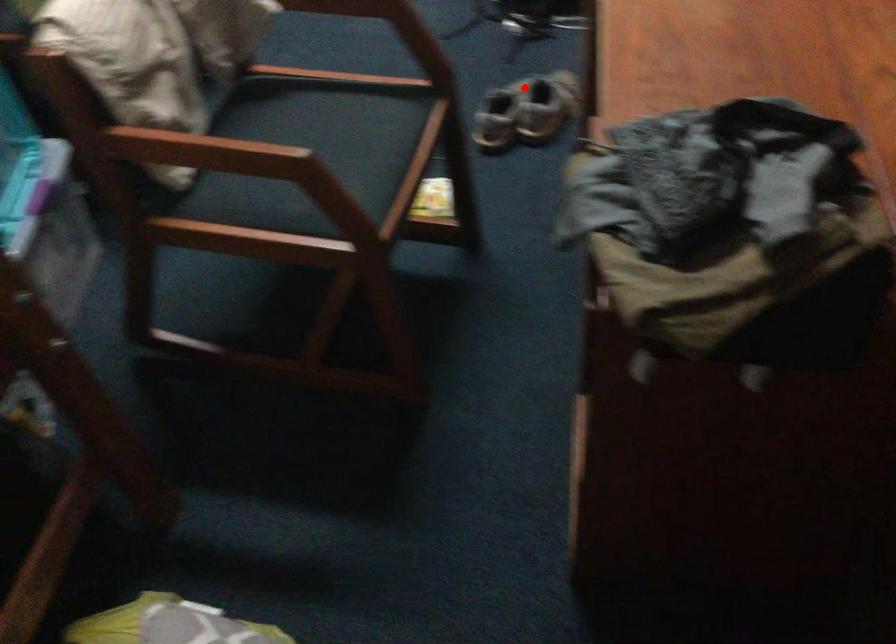
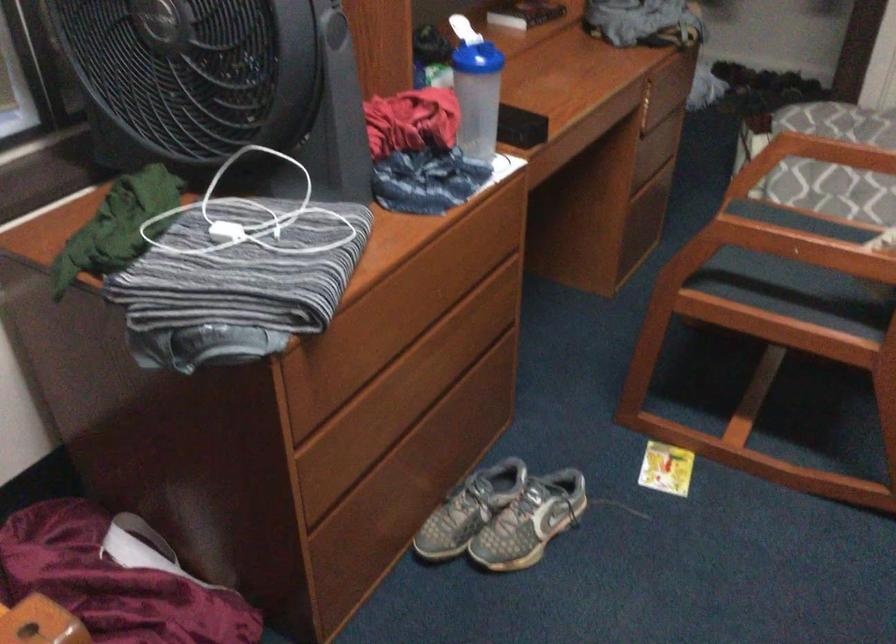
Question: I am providing you with two images of the same scene from different viewpoints. Image1 has a red point marked. In image2, the corresponding 3D location appears at what relative position? Reply with the corresponding letter.

Choices:
 (A) Closer
 (B) Farther

Answer: (A)